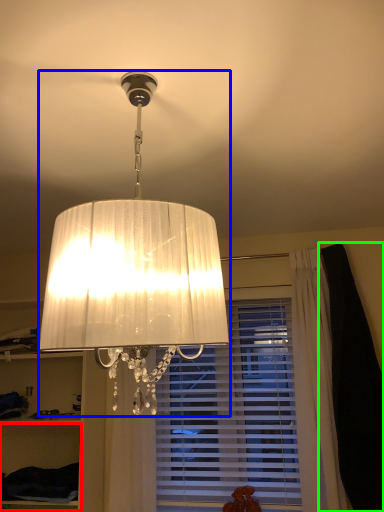
Question: Which object is positioned farthest from cabinet (highlighted by a red box)? Select from lamp (highlighted by a blue box) and dark (highlighted by a green box).

Choices:
 (A) lamp
 (B) dark

Answer: (A)